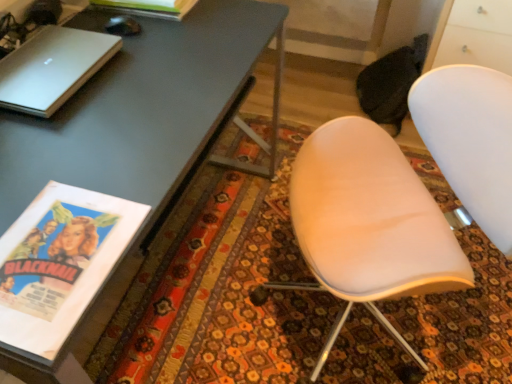
The image size is (512, 384). Identify the location of vacant area that lies in front of matte paper magazine at upper left. (153, 36).